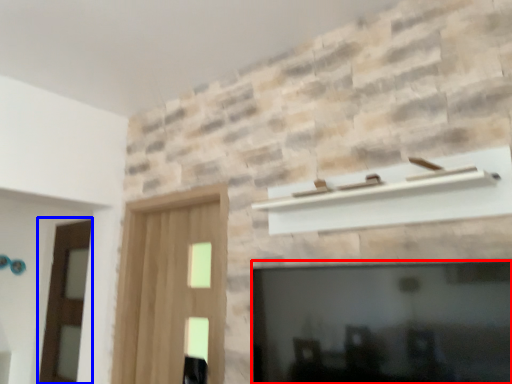
Question: Which point is closer to the camera, fireplace (highlighted by a red box) or screen door (highlighted by a blue box)?

Choices:
 (A) fireplace
 (B) screen door

Answer: (A)